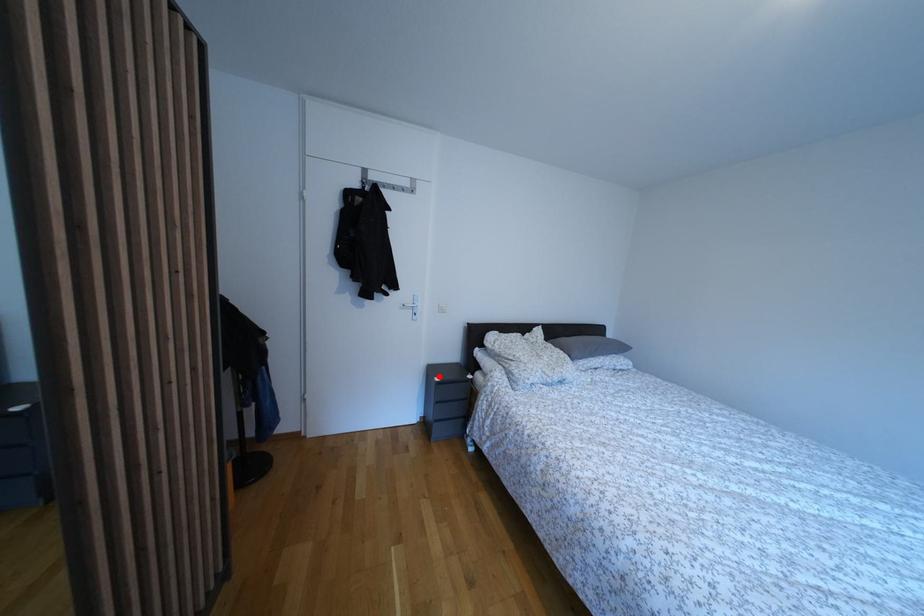
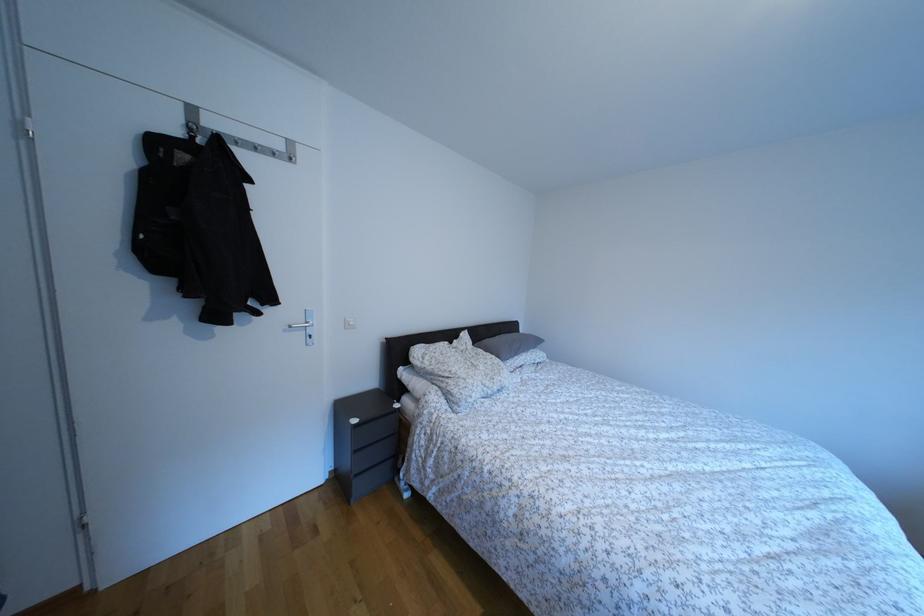
Question: A red point is marked in image1. In image2, is the corresponding 3D point closer to the camera or farther? Reply with the corresponding letter.

Choices:
 (A) The corresponding 3D point is closer.
 (B) The corresponding 3D point is farther.

Answer: (A)